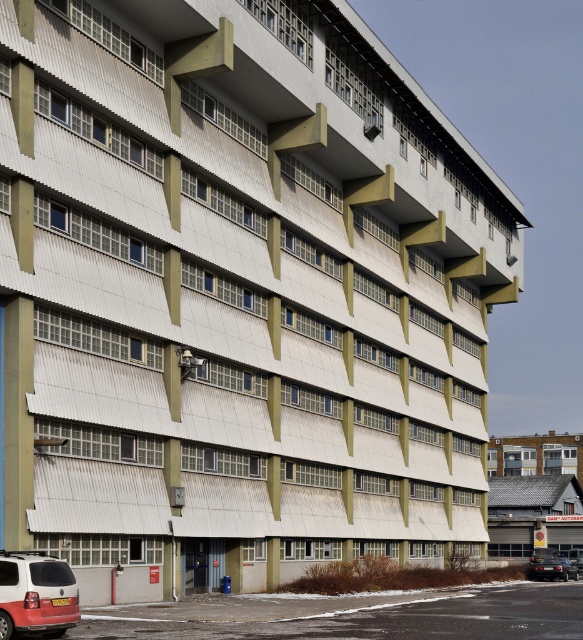
Question: Which of the following is the farthest from the observer?

Choices:
 (A) matte white van at lower right
 (B) white matte van at lower left

Answer: (A)

Question: Does shiny black sedan at lower right have a greater width compared to matte white van at lower right?

Choices:
 (A) no
 (B) yes

Answer: (A)

Question: Which object is the closest to the matte white van at lower right?

Choices:
 (A) shiny black sedan at lower right
 (B) white matte van at lower left

Answer: (A)

Question: Which point appears farthest from the camera in this image?

Choices:
 (A) (577, 579)
 (B) (574, 557)
 (C) (12, 579)

Answer: (B)

Question: Is white matte van at lower left positioned at the back of matte white van at lower right?

Choices:
 (A) no
 (B) yes

Answer: (A)

Question: In this image, where is white matte van at lower left located relative to shiny black sedan at lower right?

Choices:
 (A) right
 (B) left

Answer: (B)